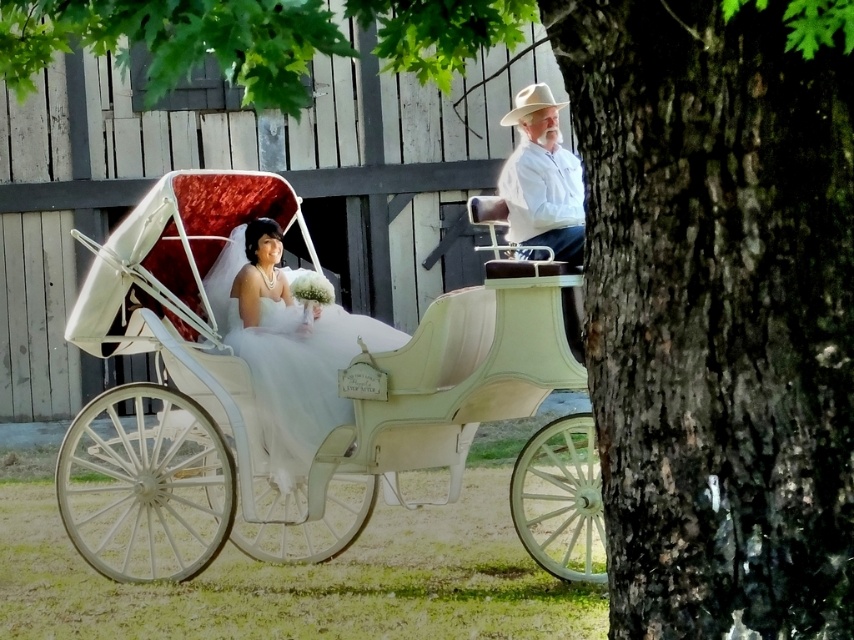
Between dark brown bark at right and white glossy horse cart at center, which one appears on the left side from the viewer's perspective?

From the viewer's perspective, white glossy horse cart at center appears more on the left side.

This screenshot has height=640, width=854. What do you see at coordinates (717, 310) in the screenshot? I see `dark brown bark at right` at bounding box center [717, 310].

Does point (656, 20) come behind point (540, 433)?

No, (656, 20) is closer to viewer.

Find the location of a particular element. dark brown bark at right is located at coordinates (717, 310).

Is white glossy horse cart at center bigger than white felt cowboy hat at upper right?

Actually, white glossy horse cart at center might be smaller than white felt cowboy hat at upper right.

Which is more to the right, white glossy horse cart at center or white felt cowboy hat at upper right?

Positioned to the right is white felt cowboy hat at upper right.

Is point (98, 280) positioned before point (537, 100)?

No.

Where is `white glossy horse cart at center`? Image resolution: width=854 pixels, height=640 pixels. white glossy horse cart at center is located at coordinates (276, 388).

Between white satin dress at center and white matte hat at upper right, which one appears on the left side from the viewer's perspective?

white satin dress at center is more to the left.

Does white satin dress at center appear on the right side of white matte hat at upper right?

Incorrect, white satin dress at center is not on the right side of white matte hat at upper right.

Where is `white satin dress at center`? This screenshot has height=640, width=854. white satin dress at center is located at coordinates (290, 353).